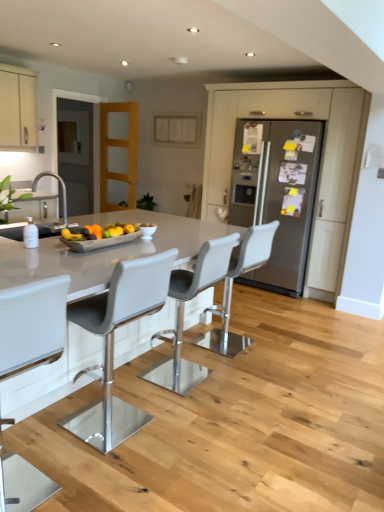
Question: Visually, is white leather bar stool at center, positioned as the fourth chair in back-to-front order, positioned to the left or to the right of transparent glass door at left?

Choices:
 (A) right
 (B) left

Answer: (A)

Question: In the image, is white leather bar stool at center, acting as the 1th chair starting from the front, positioned in front of or behind transparent glass door at left?

Choices:
 (A) behind
 (B) front

Answer: (B)

Question: Which object is the farthest from the transparent glass door at left?

Choices:
 (A) white leather bar stool at center, arranged as the 4th chair when viewed from the front
 (B) matte cream cabinet at upper left, the 3th cabinetry in the right-to-left sequence
 (C) white leather bar stool at center, placed as the third chair when sorted from back to front
 (D) white leather bar stool at center, acting as the 1th chair starting from the front
 (E) matte white cabinet at upper center, the second cabinetry positioned from the left

Answer: (D)

Question: Which of these objects is positioned farthest from the white leather bar stool at center, the first chair viewed from the back?

Choices:
 (A) satin silver fridge at center
 (B) white leather bar stool at center, positioned as the fourth chair in back-to-front order
 (C) matte cream cabinet at upper left, positioned as the 1th cabinetry in left-to-right order
 (D) polished stainless steel faucet at upper left
 (E) white leather bar stool at center, the second chair from the front

Answer: (C)